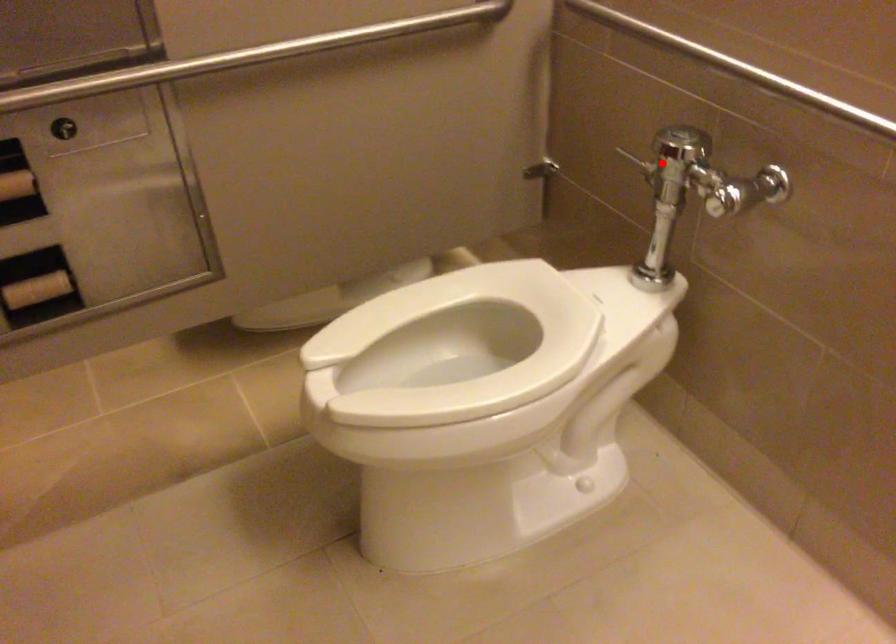
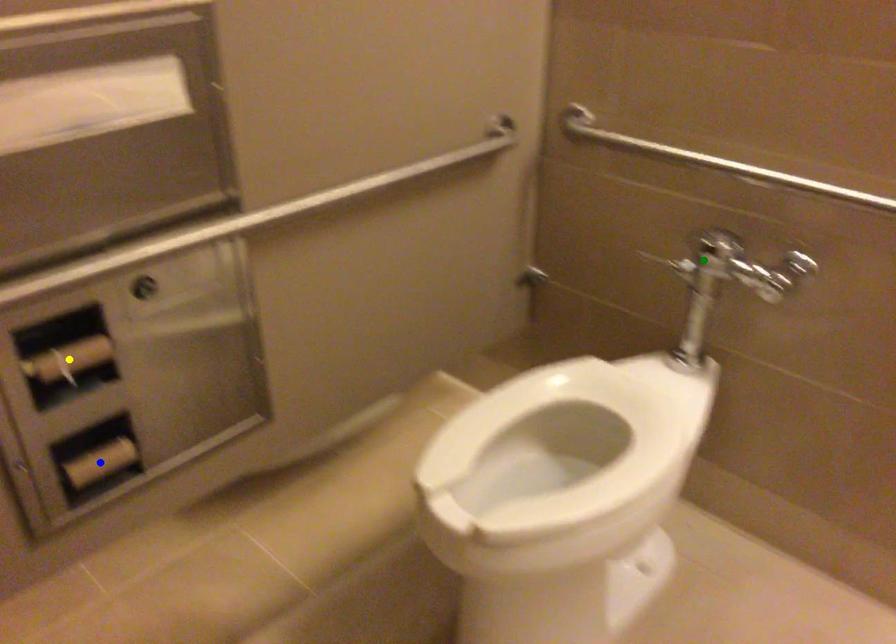
Question: I am providing you with two images of the same scene from different viewpoints. A red point is marked on the first image. You are given multiple points on the second image. Can you choose the point in image 2 that corresponds to the point in image 1?

Choices:
 (A) green point
 (B) blue point
 (C) yellow point

Answer: (A)